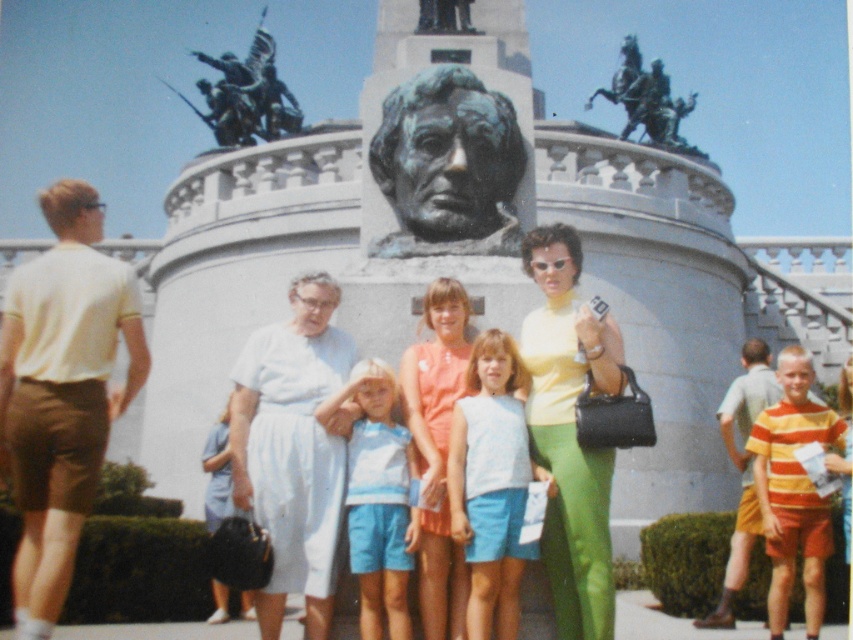
How much distance is there between white cotton dress at center and matte orange dress at center?

18.93 feet

Is white cotton dress at center bigger than matte orange dress at center?

Indeed, white cotton dress at center has a larger size compared to matte orange dress at center.

Is point (285, 568) in front of point (445, 563)?

Yes, point (285, 568) is in front of point (445, 563).

This screenshot has height=640, width=853. I want to click on white cotton dress at center, so click(x=292, y=449).

The image size is (853, 640). I want to click on bronze statue at center, so click(x=447, y=166).

Is bronze statue at center positioned at the back of light blue denim shorts at center?

Yes, bronze statue at center is behind light blue denim shorts at center.

This screenshot has width=853, height=640. In order to click on bronze statue at center in this screenshot , I will do `click(447, 166)`.

Does light blue fabric shorts at center have a larger size compared to matte orange dress at center?

No.

Consider the image. Does light blue fabric shorts at center have a lesser height compared to matte orange dress at center?

Yes, light blue fabric shorts at center is shorter than matte orange dress at center.

Who is more forward, (482, 480) or (444, 516)?

Point (482, 480)

Locate an element on the screen. The height and width of the screenshot is (640, 853). light blue fabric shorts at center is located at coordinates (492, 483).